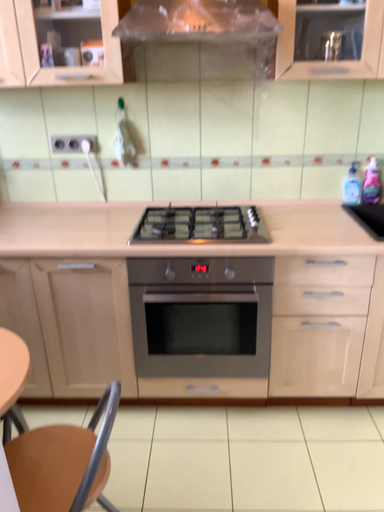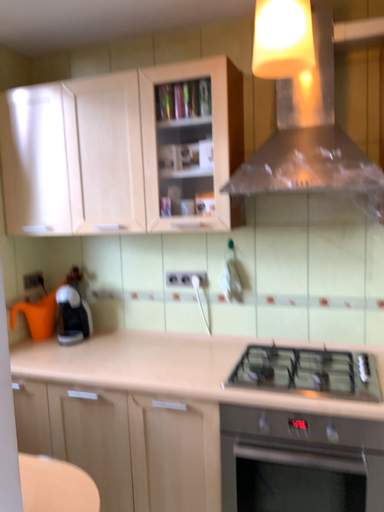
Question: How did the camera likely rotate when shooting the video?

Choices:
 (A) rotated upward
 (B) rotated downward

Answer: (A)